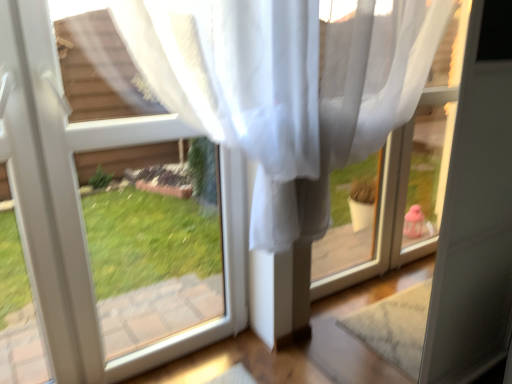
Question: Is point (15, 148) closer or farther from the camera than point (315, 291)?

Choices:
 (A) farther
 (B) closer

Answer: (B)

Question: From the image's perspective, is transparent fabric at upper left located above or below transparent plastic window frame at upper right?

Choices:
 (A) above
 (B) below

Answer: (A)

Question: In terms of height, does transparent fabric at upper left look taller or shorter compared to transparent plastic window frame at upper right?

Choices:
 (A) tall
 (B) short

Answer: (B)

Question: In terms of width, does transparent plastic window frame at upper right look wider or thinner when compared to transparent fabric at upper left?

Choices:
 (A) thin
 (B) wide

Answer: (A)

Question: Is point (324, 4) closer or farther from the camera than point (34, 228)?

Choices:
 (A) farther
 (B) closer

Answer: (B)

Question: Is transparent plastic window frame at upper right inside or outside of transparent fabric at upper left?

Choices:
 (A) outside
 (B) inside

Answer: (A)

Question: From the image's perspective, is transparent plastic window frame at upper right located above or below transparent fabric at upper left?

Choices:
 (A) below
 (B) above

Answer: (A)